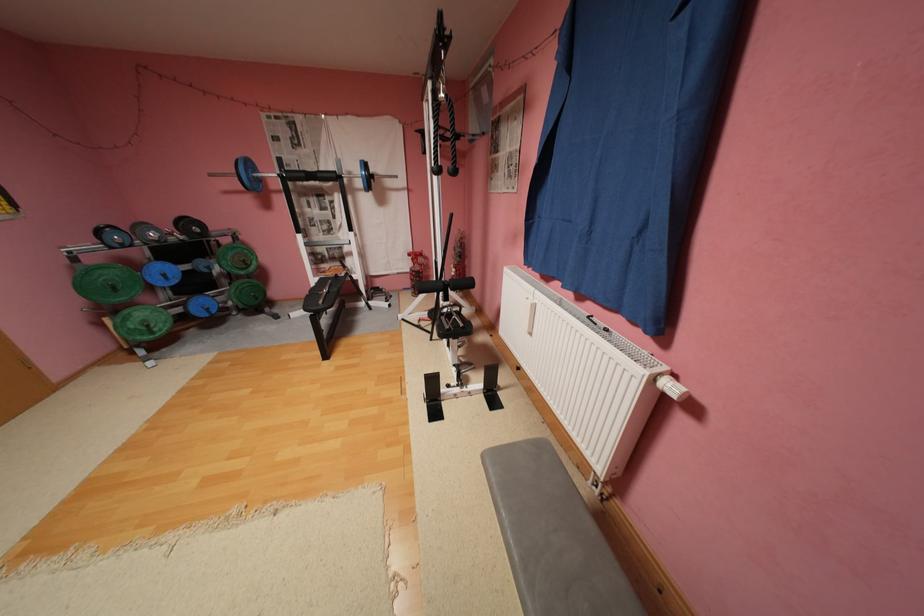
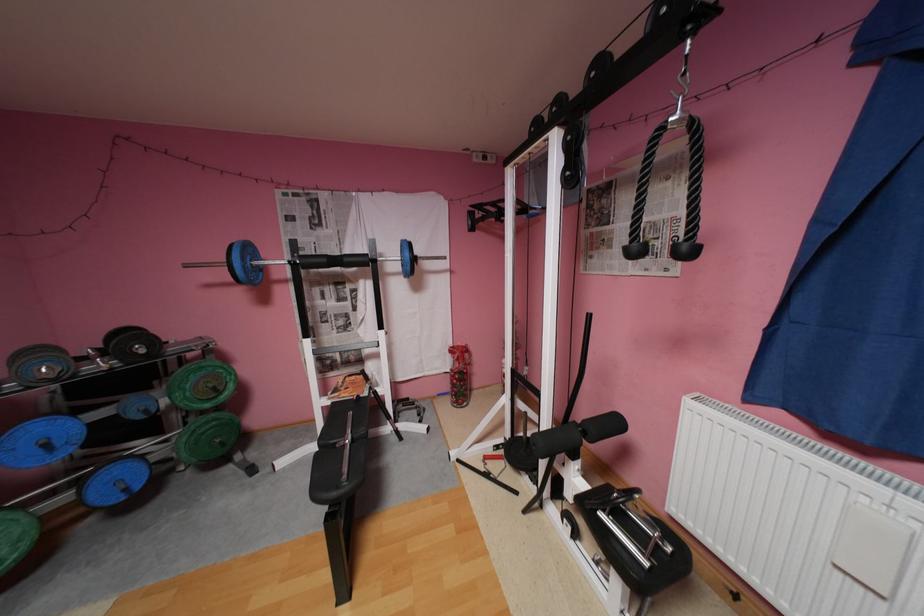
In the second image, find the point that corresponds to (x=327, y=175) in the first image.

(355, 259)